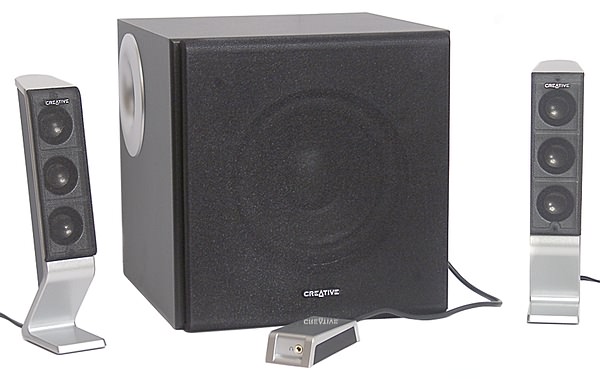
Locate an element on the screen. This screenshot has height=379, width=600. 2 small speakers is located at coordinates (61, 214), (557, 192).